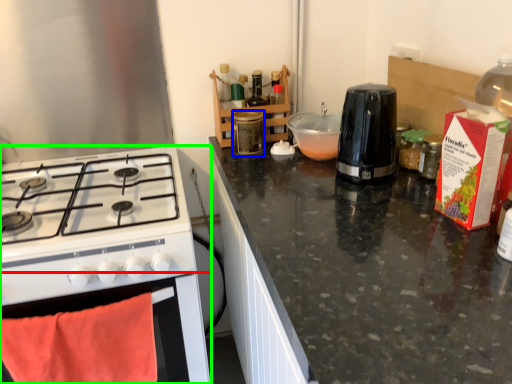
Question: Estimate the real-world distances between objects in this image. Which object is closer to oven (highlighted by a red box), bottle (highlighted by a blue box) or kitchen appliance (highlighted by a green box)?

Choices:
 (A) bottle
 (B) kitchen appliance

Answer: (B)